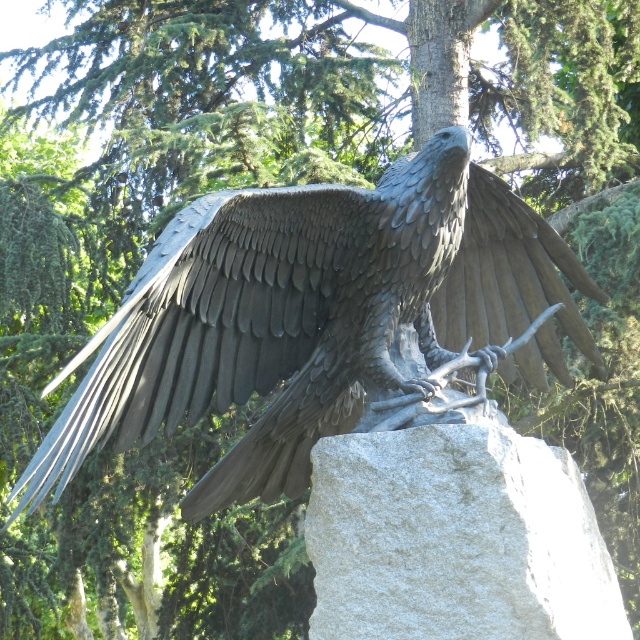
Question: Which of the following is the farthest from the observer?

Choices:
 (A) polished bronze eagle at center
 (B) gray granite boulder at center

Answer: (B)

Question: In this image, where is polished bronze eagle at center located relative to gray granite boulder at center?

Choices:
 (A) left
 (B) right

Answer: (A)

Question: Which point appears farthest from the camera in this image?

Choices:
 (A) pos(358,278)
 (B) pos(556,580)

Answer: (A)

Question: Does polished bronze eagle at center appear under gray granite boulder at center?

Choices:
 (A) yes
 (B) no

Answer: (B)

Question: Which point is farther to the camera?

Choices:
 (A) gray granite boulder at center
 (B) polished bronze eagle at center

Answer: (A)

Question: Does polished bronze eagle at center appear under gray granite boulder at center?

Choices:
 (A) yes
 (B) no

Answer: (B)